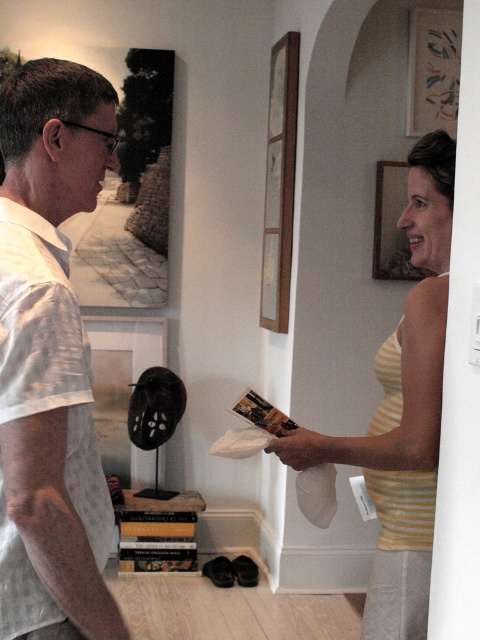
Who is more forward, (409,461) or (101,388)?

Point (409,461)

Is yellow striped tank top at right to the left of black matte picture frame at left from the viewer's perspective?

No, yellow striped tank top at right is not to the left of black matte picture frame at left.

Where is `yellow striped tank top at right`? The width and height of the screenshot is (480, 640). yellow striped tank top at right is located at coordinates (403, 412).

Is point (264, 237) positioned behind point (431, 68)?

Yes, point (264, 237) is farther from viewer.

Does wooden picture frame at upper center appear under matte wood picture frame at upper right?

Correct, wooden picture frame at upper center is located below matte wood picture frame at upper right.

The width and height of the screenshot is (480, 640). I want to click on wooden picture frame at upper center, so click(x=279, y=182).

Is yellow striped tank top at right smaller than matte wood picture frame at upper right?

No.

Does yellow striped tank top at right lie in front of matte wood picture frame at upper right?

Yes, yellow striped tank top at right is closer to the viewer.

Describe the element at coordinates (403, 412) in the screenshot. The image size is (480, 640). I see `yellow striped tank top at right` at that location.

Identify the location of yellow striped tank top at right. Image resolution: width=480 pixels, height=640 pixels. (403, 412).